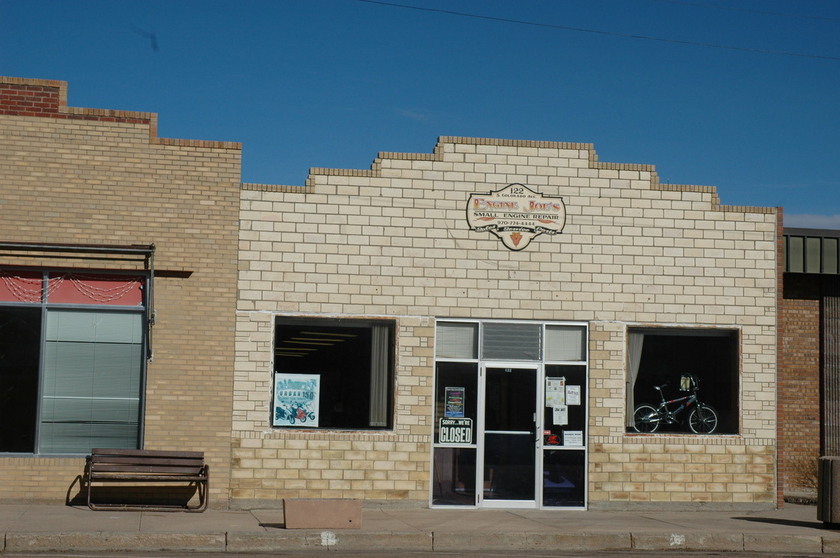
Locate an element on the screen. window is located at coordinates (352, 380), (670, 365).